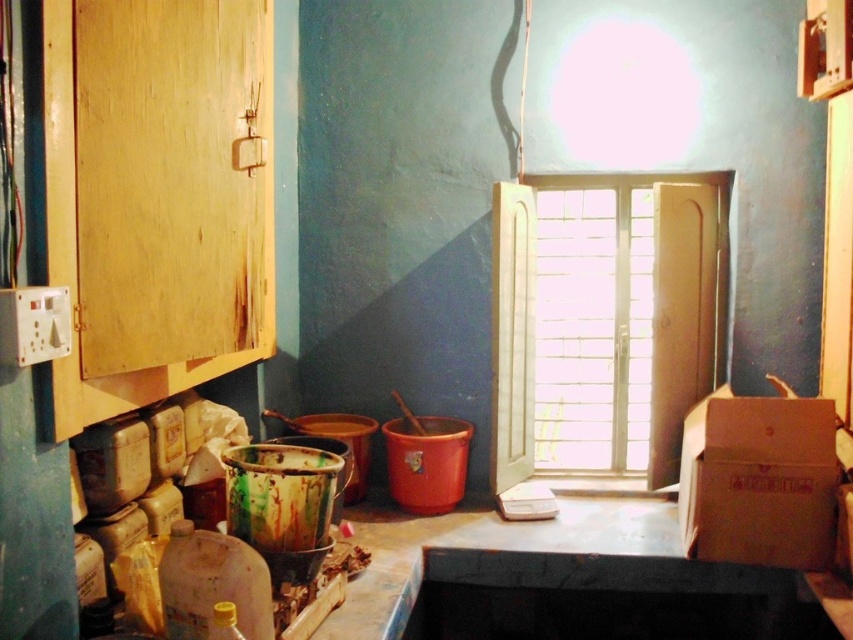
Question: Which of the following is the farthest from the observer?

Choices:
 (A) wooden window at center
 (B) brown cardboard box at right

Answer: (A)

Question: Can you confirm if wooden window at center is bigger than brown cardboard box at right?

Choices:
 (A) yes
 (B) no

Answer: (A)

Question: Does wooden window at center have a smaller size compared to brown cardboard box at right?

Choices:
 (A) no
 (B) yes

Answer: (A)

Question: Among these points, which one is nearest to the camera?

Choices:
 (A) (820, 497)
 (B) (572, 340)

Answer: (A)

Question: Which point is farther to the camera?

Choices:
 (A) (706, 460)
 (B) (556, 282)

Answer: (B)

Question: Does wooden window at center have a greater width compared to brown cardboard box at right?

Choices:
 (A) yes
 (B) no

Answer: (A)